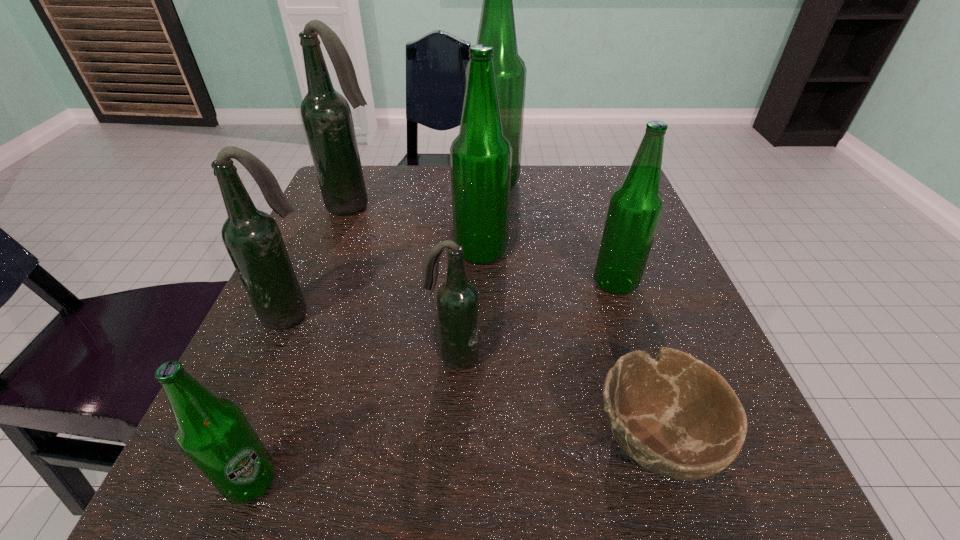
In order to click on the nearest green beer bottle in this screenshot , I will do `click(214, 433)`.

Locate an element on the screen. The image size is (960, 540). the smallest green beer bottle is located at coordinates (214, 433).

This screenshot has height=540, width=960. I want to click on the shortest object, so click(674, 415).

Find the location of a particular element. Image resolution: width=960 pixels, height=540 pixels. blank area located on the label of the tallest object is located at coordinates (390, 183).

Locate an element on the screen. The width and height of the screenshot is (960, 540). vacant space located 0.170m on the label of the tallest object is located at coordinates (398, 183).

Find the location of a particular element. vacant space located on the label of the tallest object is located at coordinates (431, 183).

At what (x,y) coordinates should I click in order to perform the action: click on free region located 0.080m on the right of the biggest dark beer bottle. Please return your answer as a coordinate pair (x, y). The width and height of the screenshot is (960, 540). Looking at the image, I should click on (420, 206).

Identify the location of vacant space situated 0.130m on the label of the third farthest beer bottle. (389, 252).

Find the location of a particular element. This screenshot has width=960, height=540. vacant position located on the label of the third farthest beer bottle is located at coordinates (389, 252).

This screenshot has width=960, height=540. In order to click on vacant area located on the label of the third farthest beer bottle in this screenshot , I will do `click(424, 252)`.